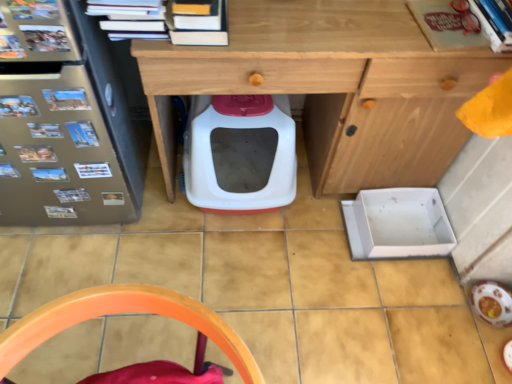
Find the location of a particular element. The image size is (512, 384). vacant area in front of white plastic litter box at center is located at coordinates (234, 266).